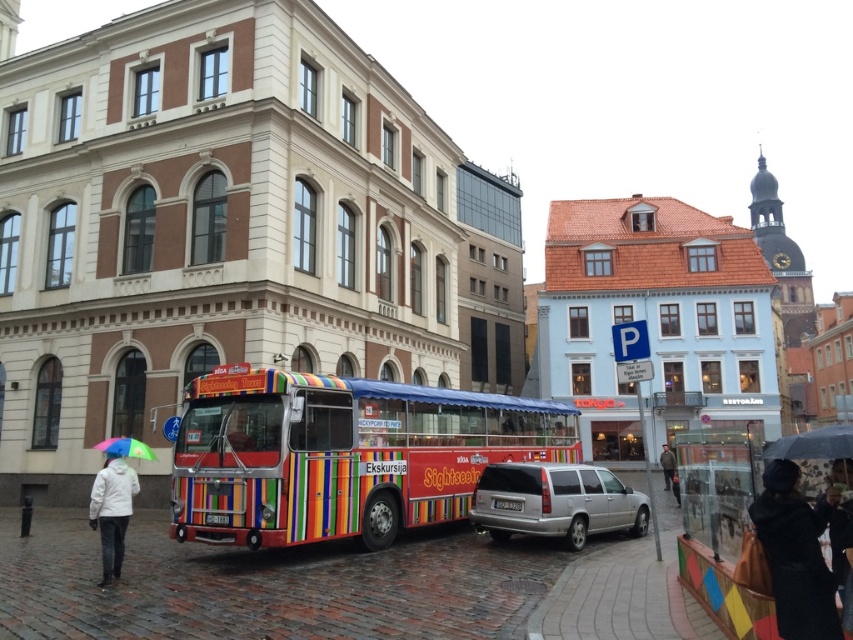
Is rainbow striped decker bus at center bigger than black leather coat at lower right?

Yes, rainbow striped decker bus at center is bigger than black leather coat at lower right.

Locate an element on the screen. The width and height of the screenshot is (853, 640). rainbow striped decker bus at center is located at coordinates (343, 454).

Locate an element on the screen. This screenshot has width=853, height=640. rainbow striped decker bus at center is located at coordinates (343, 454).

Who is taller, white matte jacket at lower left or rainbow striped umbrella at lower left?

white matte jacket at lower left

Can you confirm if white matte jacket at lower left is wider than rainbow striped umbrella at lower left?

Yes, white matte jacket at lower left is wider than rainbow striped umbrella at lower left.

Is point (125, 490) positioned in front of point (102, 449)?

Yes, point (125, 490) is closer to viewer.

Locate an element on the screen. The height and width of the screenshot is (640, 853). white matte jacket at lower left is located at coordinates (112, 512).

Looking at this image, is the position of black leather coat at lower right less distant than that of rainbow striped umbrella at lower left?

Yes.

Does black leather coat at lower right appear on the left side of rainbow striped umbrella at lower left?

In fact, black leather coat at lower right is to the right of rainbow striped umbrella at lower left.

Does point (773, 481) come farther from viewer compared to point (126, 449)?

No, it is in front of (126, 449).

Locate an element on the screen. The width and height of the screenshot is (853, 640). black leather coat at lower right is located at coordinates (796, 554).